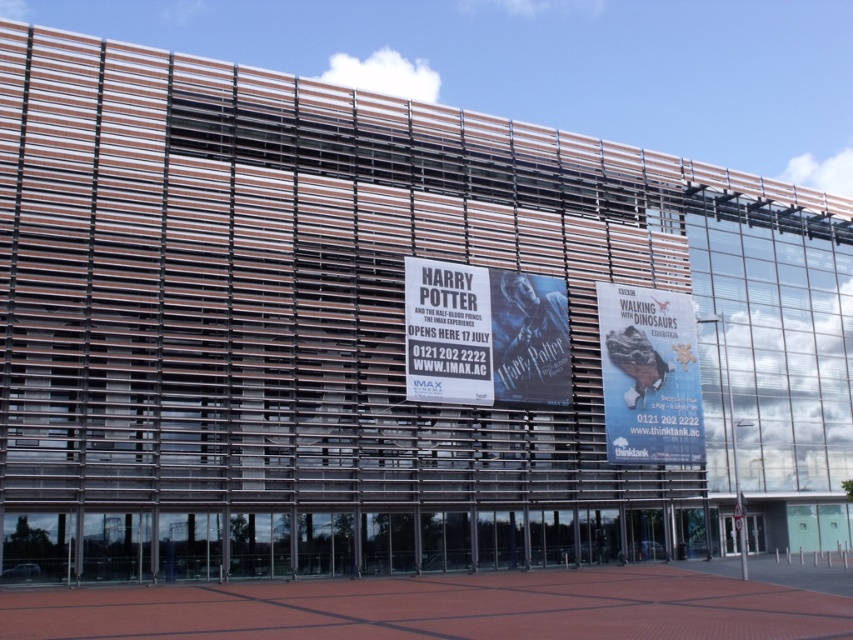
Question: Which point is farther to the camera?

Choices:
 (A) (471, 321)
 (B) (634, 296)

Answer: (B)

Question: Which point is closer to the camera taking this photo?

Choices:
 (A) (640, 298)
 (B) (434, 278)

Answer: (B)

Question: Among these objects, which one is farthest from the camera?

Choices:
 (A) white paper poster at center
 (B) white paper billboard at center

Answer: (B)

Question: Does white paper billboard at center have a larger size compared to white paper poster at center?

Choices:
 (A) yes
 (B) no

Answer: (A)

Question: Is the position of white paper billboard at center less distant than that of white paper poster at center?

Choices:
 (A) no
 (B) yes

Answer: (A)

Question: From the image, what is the correct spatial relationship of white paper billboard at center in relation to white paper poster at center?

Choices:
 (A) below
 (B) above

Answer: (A)